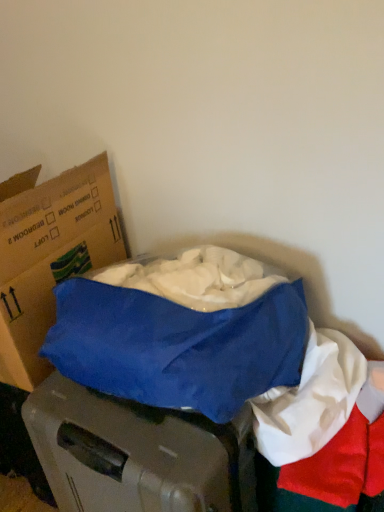
Question: Can you confirm if blue fabric at center is shorter than cardboard box at left?

Choices:
 (A) yes
 (B) no

Answer: (A)

Question: Can you see blue fabric at center touching cardboard box at left?

Choices:
 (A) yes
 (B) no

Answer: (B)

Question: Can you confirm if blue fabric at center is taller than cardboard box at left?

Choices:
 (A) yes
 (B) no

Answer: (B)

Question: Is blue fabric at center oriented away from cardboard box at left?

Choices:
 (A) yes
 (B) no

Answer: (B)

Question: Is blue fabric at center in front of cardboard box at left?

Choices:
 (A) no
 (B) yes

Answer: (B)

Question: Is blue fabric at center smaller than cardboard box at left?

Choices:
 (A) no
 (B) yes

Answer: (B)

Question: Is cardboard box at left directly adjacent to blue fabric at center?

Choices:
 (A) no
 (B) yes

Answer: (A)

Question: From a real-world perspective, is cardboard box at left physically above blue fabric at center?

Choices:
 (A) yes
 (B) no

Answer: (A)

Question: From a real-world perspective, is cardboard box at left under blue fabric at center?

Choices:
 (A) yes
 (B) no

Answer: (B)

Question: Is cardboard box at left positioned far away from blue fabric at center?

Choices:
 (A) yes
 (B) no

Answer: (B)

Question: From the image's perspective, is cardboard box at left above blue fabric at center?

Choices:
 (A) no
 (B) yes

Answer: (B)

Question: Does cardboard box at left have a larger size compared to blue fabric at center?

Choices:
 (A) no
 (B) yes

Answer: (B)

Question: In terms of height, does blue fabric at center look taller or shorter compared to cardboard box at left?

Choices:
 (A) tall
 (B) short

Answer: (B)